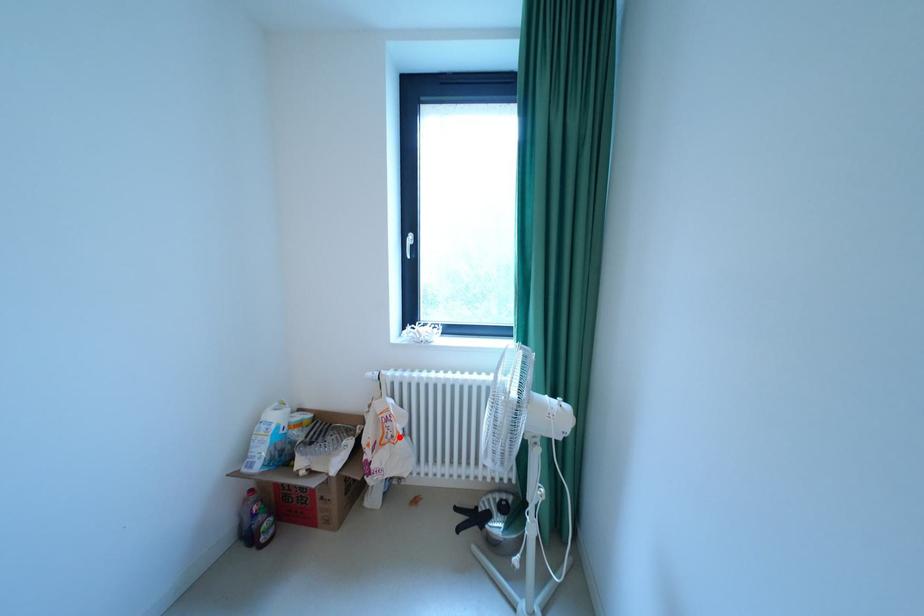
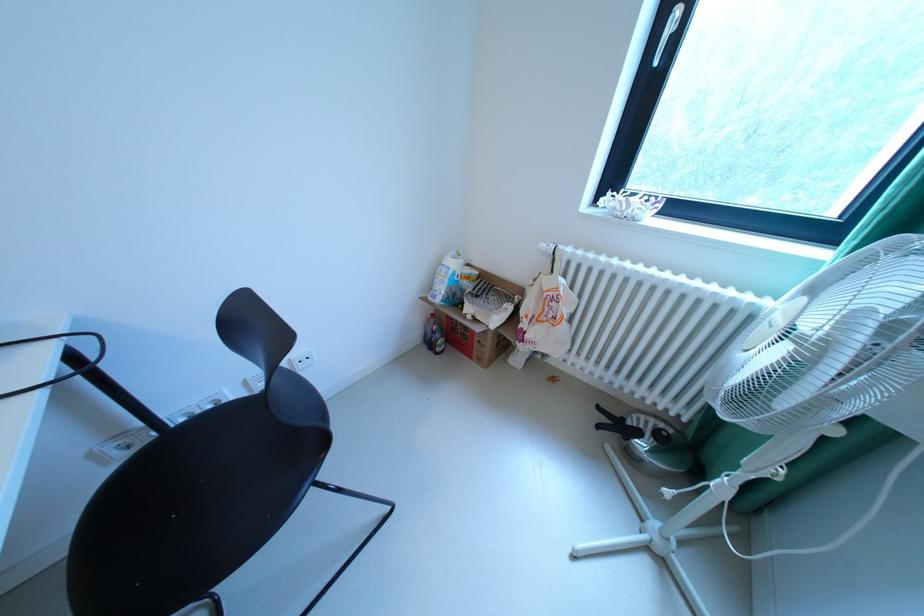
Question: A red point is marked in image1. In image2, is the corresponding 3D point closer to the camera or farther? Reply with the corresponding letter.

Choices:
 (A) The corresponding 3D point is closer.
 (B) The corresponding 3D point is farther.

Answer: (A)